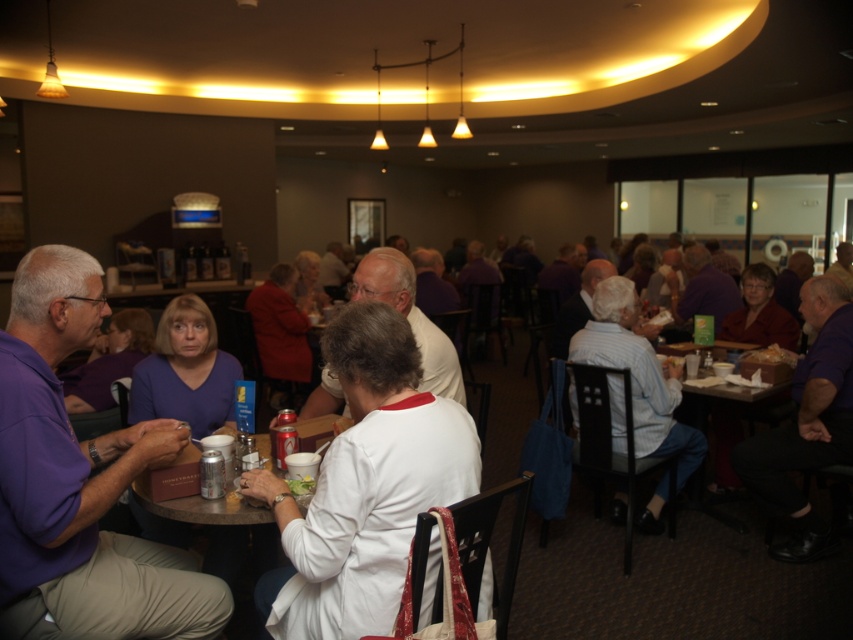
Which is in front, point (373, 605) or point (431, 364)?

Positioned in front is point (373, 605).

Identify the location of white matte shirt at center. The image size is (853, 640). (364, 484).

This screenshot has height=640, width=853. I want to click on white matte shirt at center, so (x=364, y=484).

Can you confirm if white cotton shirt at center is positioned to the right of metallic silver table at center?

Yes, white cotton shirt at center is to the right of metallic silver table at center.

Which is above, white cotton shirt at center or metallic silver table at center?

white cotton shirt at center is above.

Where is `white cotton shirt at center`? Image resolution: width=853 pixels, height=640 pixels. white cotton shirt at center is located at coordinates (637, 376).

Can you confirm if metallic silver table at center is taller than matte purple shirt at center?

Yes, metallic silver table at center is taller than matte purple shirt at center.

Which of these two, metallic silver table at center or matte purple shirt at center, stands shorter?

matte purple shirt at center is shorter.

Who is more forward, (234, 536) or (167, 360)?

Point (234, 536) is in front.

This screenshot has width=853, height=640. Find the location of `metallic silver table at center`. metallic silver table at center is located at coordinates (219, 541).